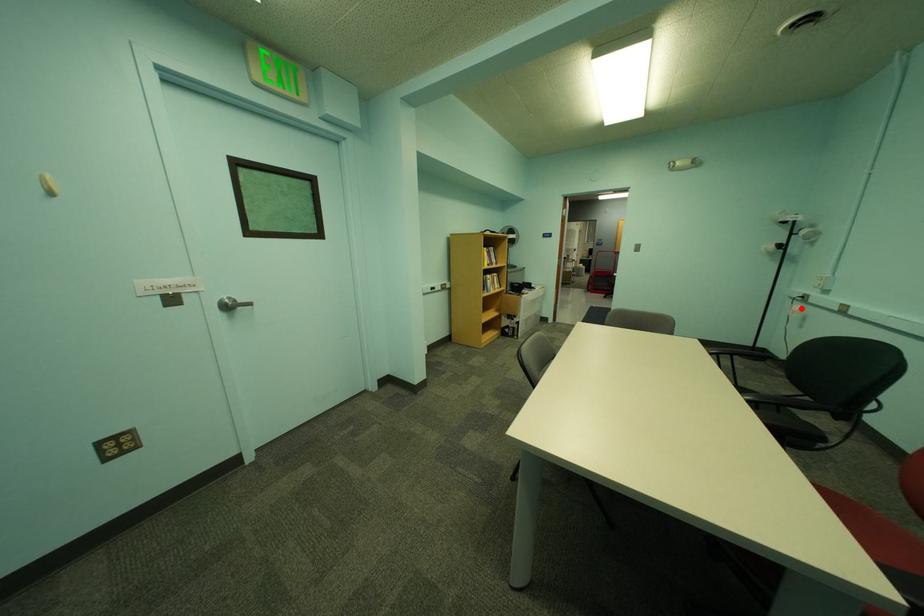
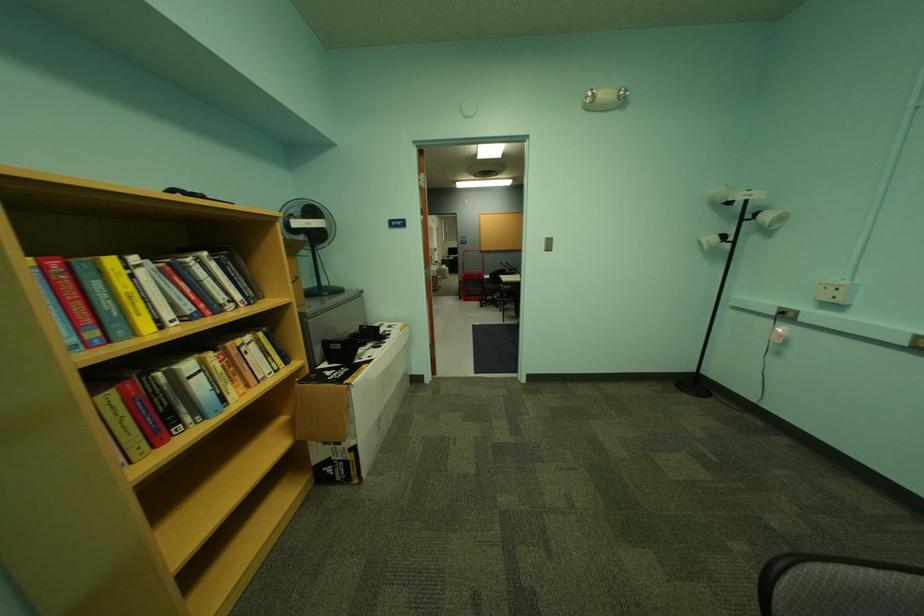
Find the pixel in the second image that matches the highlighted location in the first image.

(783, 330)